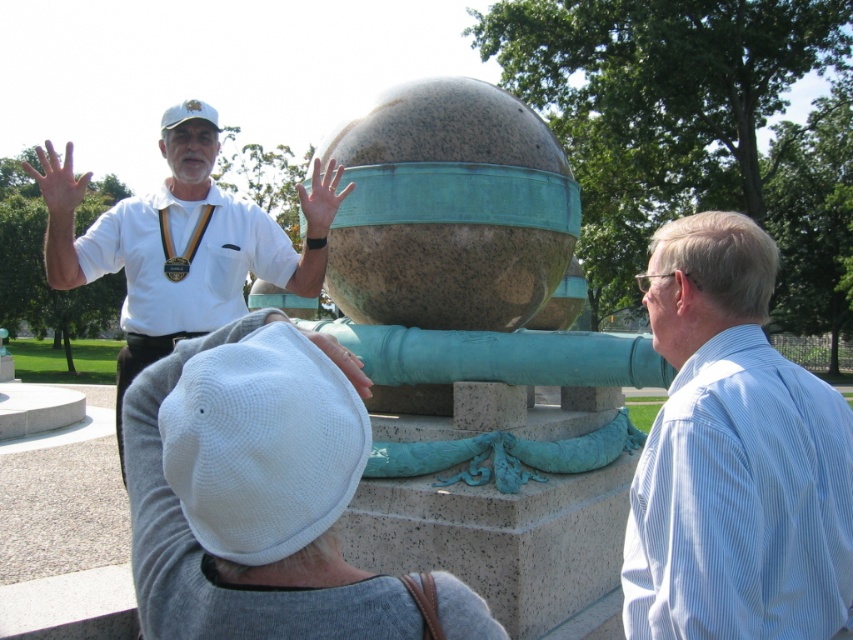
You are an artist planning to create a scale model of the granite sphere at center and the white cotton shirt at upper left for an exhibition. Which object should you make larger in your model to maintain accurate proportions?

The granite sphere at center should be made larger in the model since it has a larger size compared to the white cotton shirt at upper left.

You are planning to take a photo of the granite sphere at center and the white cotton shirt at upper left. Which object should you focus on first if you want to ensure both are in sharp focus, considering their positions relative to the camera?

The white cotton shirt at upper left is closer to the camera than the granite sphere at center. To ensure both are in focus, you should focus on the white cotton shirt at upper left first.

You are a visitor at an art exhibition and see the granite sphere at center and the white cotton shirt at upper left. Which object is positioned higher in the image?

The white cotton shirt at upper left is positioned higher in the image than the granite sphere at center.